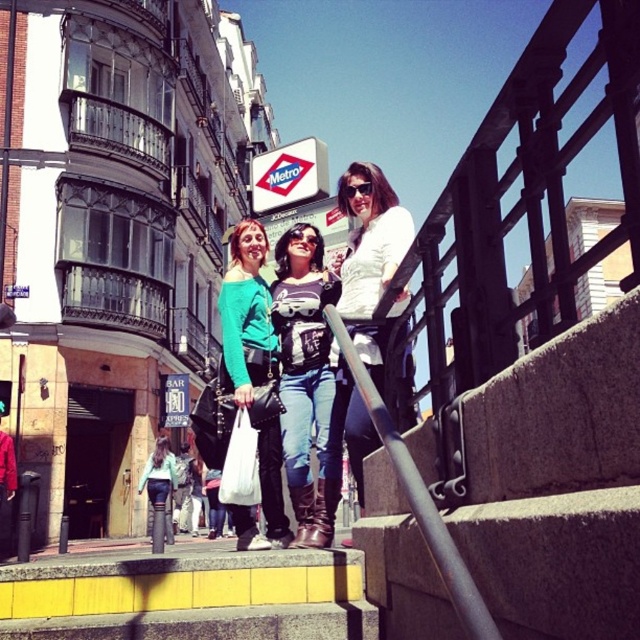
Question: Is the position of concrete stairs at lower right more distant than that of black plastic sunglasses at center?

Choices:
 (A) no
 (B) yes

Answer: (A)

Question: Does denim jeans at center come in front of denim jeans at lower left?

Choices:
 (A) yes
 (B) no

Answer: (A)

Question: Which object is the farthest from the white matte jacket at upper center?

Choices:
 (A) matte teal sweater at center
 (B) concrete stairs at lower right

Answer: (B)

Question: Observing the image, what is the correct spatial positioning of concrete stairs at lower right in reference to white matte plastic bag at center?

Choices:
 (A) left
 (B) right

Answer: (B)

Question: Which point is closer to the camera?

Choices:
 (A) (256, 336)
 (B) (296, 410)
 (C) (568, 385)

Answer: (C)

Question: Which point appears farthest from the camera in this image?

Choices:
 (A) (260, 426)
 (B) (387, 205)

Answer: (B)